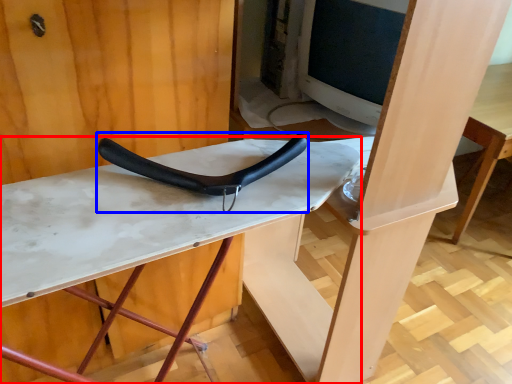
Question: Which point is further to the camera, table (highlighted by a red box) or handle (highlighted by a blue box)?

Choices:
 (A) table
 (B) handle

Answer: (B)